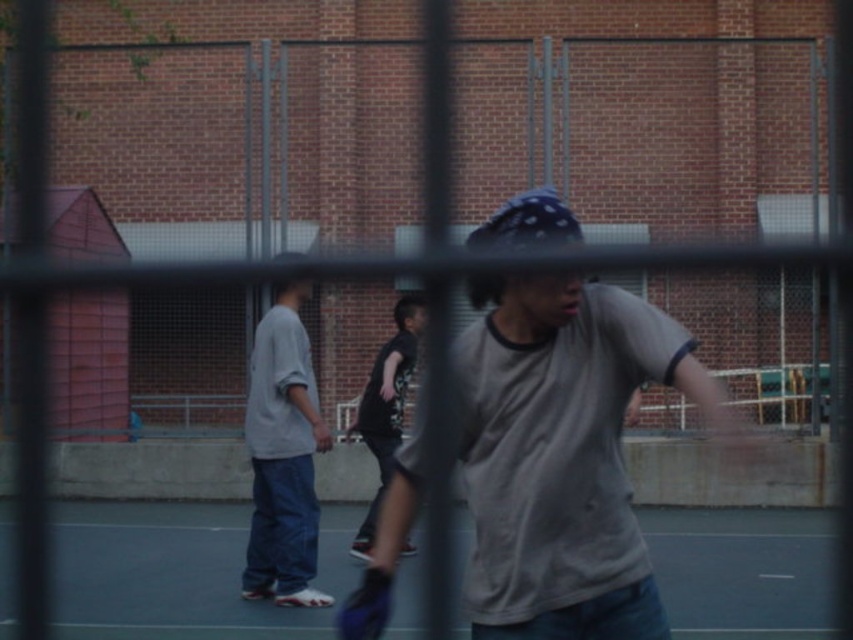
Question: Does light gray cotton shirt at left have a larger size compared to dark gray t-shirt at center?

Choices:
 (A) no
 (B) yes

Answer: (B)

Question: Among these objects, which one is farthest from the camera?

Choices:
 (A) smooth asphalt court at center
 (B) gray matte t-shirt at center
 (C) dark gray t-shirt at center

Answer: (A)

Question: Does smooth asphalt court at center appear under light gray cotton shirt at left?

Choices:
 (A) no
 (B) yes

Answer: (B)

Question: Which object is the farthest from the smooth asphalt court at center?

Choices:
 (A) gray matte t-shirt at center
 (B) dark gray t-shirt at center
 (C) light gray cotton shirt at left

Answer: (A)

Question: Is smooth asphalt court at center closer to the viewer compared to dark gray t-shirt at center?

Choices:
 (A) yes
 (B) no

Answer: (B)

Question: Among these points, which one is farthest from the camera?

Choices:
 (A) (264, 467)
 (B) (659, 518)
 (C) (514, 340)
 (D) (349, 433)

Answer: (B)